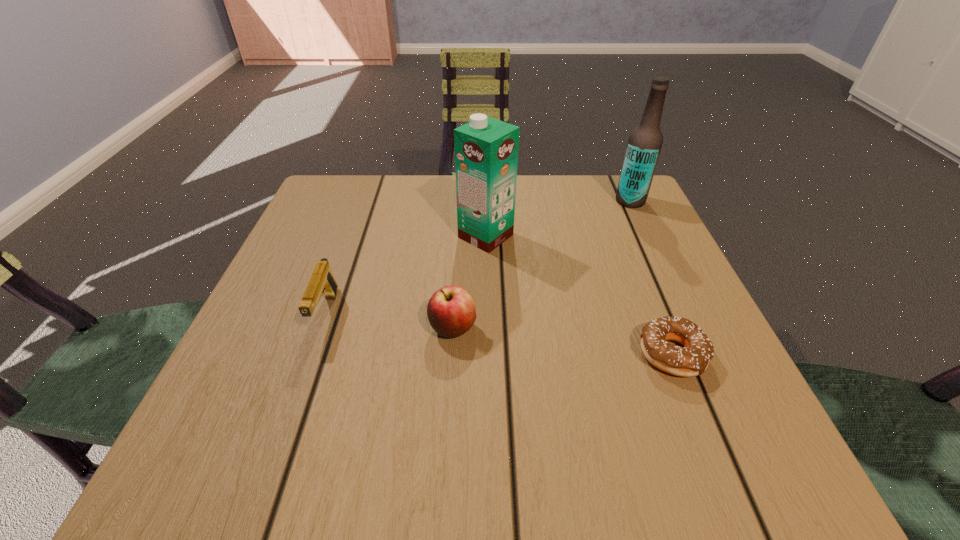
The image size is (960, 540). In order to click on vacant space located at the barrel of the pistol in this screenshot , I will do `click(274, 461)`.

This screenshot has height=540, width=960. I want to click on vacant region located on the back of the doughnut, so click(x=624, y=237).

What are the coordinates of `beer bottle situated at the far edge` in the screenshot? It's located at (644, 145).

Locate an element on the screen. carton that is at the far edge is located at coordinates (486, 150).

The height and width of the screenshot is (540, 960). Find the location of `object that is at the left edge`. object that is at the left edge is located at coordinates (322, 282).

The width and height of the screenshot is (960, 540). I want to click on beer bottle that is at the right edge, so click(644, 145).

This screenshot has width=960, height=540. Find the location of `doughnut that is positioned at the right edge`. doughnut that is positioned at the right edge is located at coordinates (691, 360).

The height and width of the screenshot is (540, 960). I want to click on object located at the far right corner, so click(644, 145).

This screenshot has width=960, height=540. In the image, there is a desktop. Identify the location of blank space at the far edge. (411, 200).

In the image, there is a desktop. What are the coordinates of `vacant space at the near edge` in the screenshot? It's located at (589, 431).